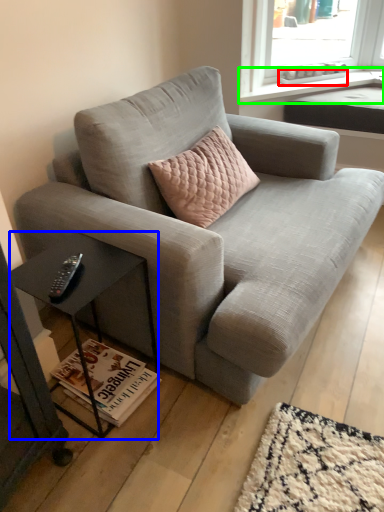
Question: Which object is the closest to the window sill (highlighted by a red box)? Choose among these: table (highlighted by a blue box) or window sill (highlighted by a green box).

Choices:
 (A) table
 (B) window sill

Answer: (B)